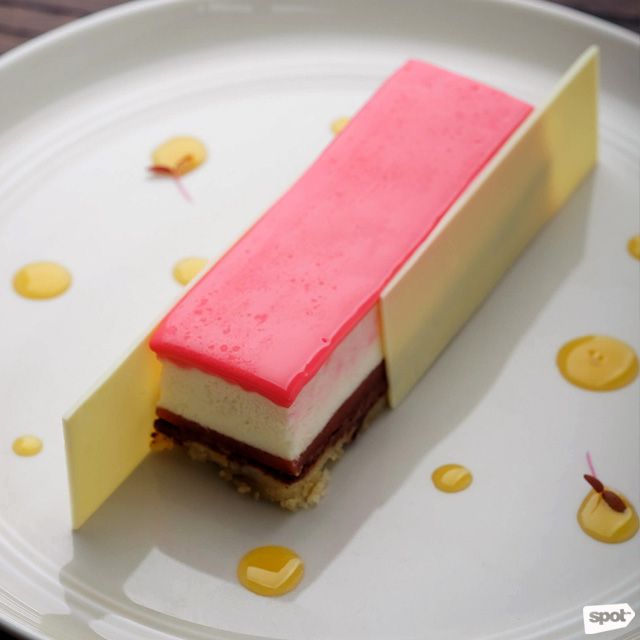
Find the location of a particular element. The width and height of the screenshot is (640, 640). plate is located at coordinates (49, 518).